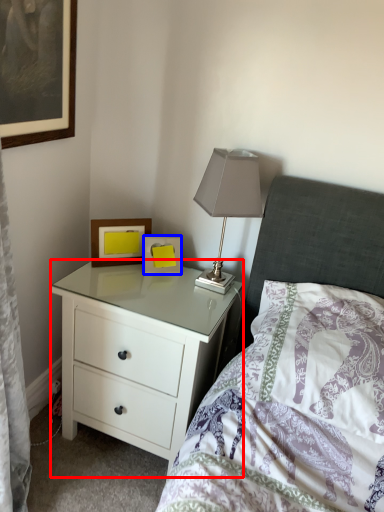
Question: Among these objects, which one is nearest to the camera, chest of drawers (highlighted by a red box) or picture frame (highlighted by a blue box)?

Choices:
 (A) chest of drawers
 (B) picture frame

Answer: (A)